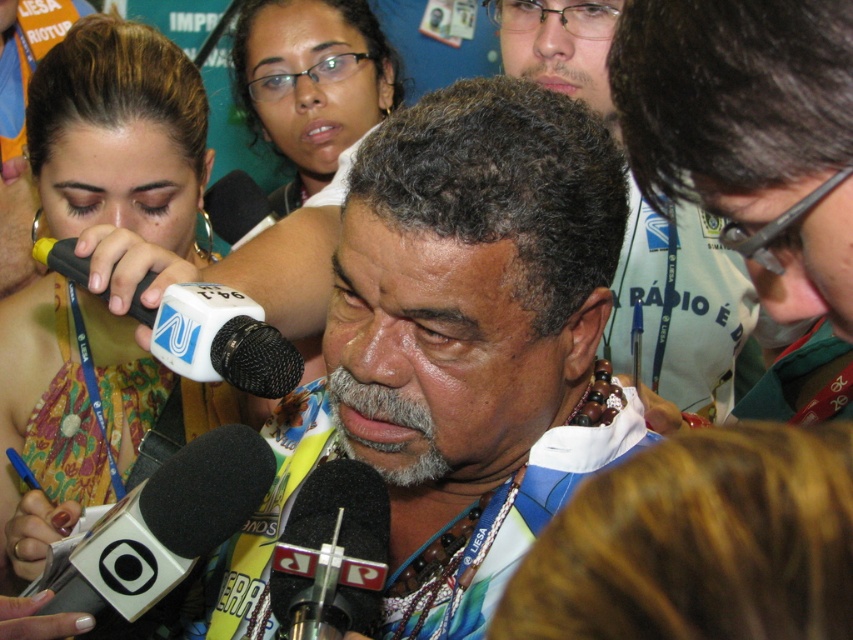
You are a photographer at the event and want to capture a clear photo of the multicolored fabric shirt at center and the matte black glasses at upper center. Since the camera can only focus on one object at a time, which object should you focus on to ensure it appears larger in the photo?

The multicolored fabric shirt at center is taller than the matte black glasses at upper center, so focusing on the multicolored fabric shirt at center will ensure it appears larger in the photo.

Based on the coordinates provided, which object is located at point (119, 134)?

The matte yellow dress at center is located at point (119, 134).

You are a photographer trying to capture a closeup of the multicolored beaded necklace at center. The camera you are using has a minimum focusing distance of 3 feet. Will you be able to take the photo without moving closer?

The multicolored beaded necklace at center is 3.58 feet from the camera. Since the minimum focusing distance is 3 feet, the photographer can take the closeup without moving closer because the distance is within the camera range.